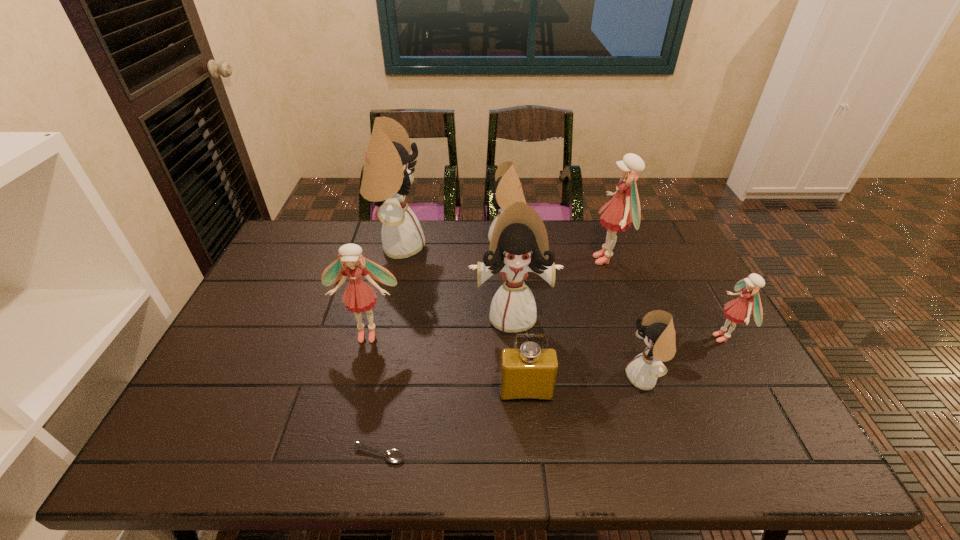
What are the coordinates of `free region located on the back of the soupspoon` in the screenshot? It's located at (402, 325).

The height and width of the screenshot is (540, 960). In order to click on object situated at the near edge in this screenshot , I will do `click(394, 456)`.

At what (x,y) coordinates should I click in order to perform the action: click on object located in the right edge section of the desktop. Please return your answer as a coordinate pair (x, y). Looking at the image, I should click on (737, 311).

This screenshot has height=540, width=960. In order to click on vacant space at the far edge of the desktop in this screenshot , I will do `click(554, 247)`.

The image size is (960, 540). Identify the location of free spot at the near edge of the desktop. (675, 448).

This screenshot has width=960, height=540. Identify the location of free space at the left edge. [x=255, y=287].

What are the coordinates of `free space at the right edge of the desktop` in the screenshot? It's located at (704, 316).

This screenshot has height=540, width=960. In order to click on vacant space at the far left corner of the desktop in this screenshot , I will do `click(291, 233)`.

Where is `vacant area at the near right corner`? vacant area at the near right corner is located at coordinates (783, 433).

You are a GUI agent. You are given a task and a screenshot of the screen. Output one action in this format:
    pyautogui.click(x=<x>, y=<y>)
    Task: Click on the free space between the leftmost pink doll and the third farthest black doll
    Image resolution: width=960 pixels, height=540 pixels.
    Given the screenshot: What is the action you would take?
    pyautogui.click(x=441, y=325)